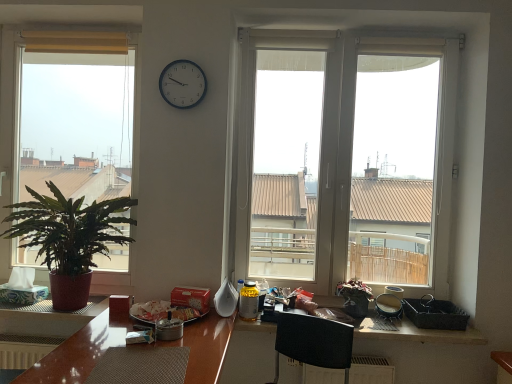
Question: Should I look upward or downward to see white plastic window at center, positioned as the 1th window in right-to-left order?

Choices:
 (A) up
 (B) down

Answer: (A)

Question: Is metallic clock at upper center inside white plastic window at center, the second window when ordered from left to right?

Choices:
 (A) yes
 (B) no

Answer: (B)

Question: Is white plastic window at center, positioned as the 1th window in right-to-left order, shorter than metallic clock at upper center?

Choices:
 (A) no
 (B) yes

Answer: (A)

Question: Is white plastic window at center, positioned as the 1th window in right-to-left order, aimed at metallic clock at upper center?

Choices:
 (A) yes
 (B) no

Answer: (B)

Question: From a real-world perspective, is white plastic window at center, positioned as the 1th window in right-to-left order, located beneath metallic clock at upper center?

Choices:
 (A) no
 (B) yes

Answer: (B)

Question: Can you confirm if white plastic window at center, positioned as the 1th window in right-to-left order, is thinner than metallic clock at upper center?

Choices:
 (A) yes
 (B) no

Answer: (B)

Question: Is white plastic window at center, the second window when ordered from left to right, smaller than metallic clock at upper center?

Choices:
 (A) yes
 (B) no

Answer: (B)

Question: Could you tell me if metallic clock at upper center is turned towards green matte plant at left, which appears as the 1th window when viewed from the left?

Choices:
 (A) yes
 (B) no

Answer: (B)

Question: Is metallic clock at upper center behind green matte plant at left, acting as the 2th window starting from the right?

Choices:
 (A) no
 (B) yes

Answer: (A)

Question: From a real-world perspective, is metallic clock at upper center located higher than green matte plant at left, which appears as the 1th window when viewed from the left?

Choices:
 (A) yes
 (B) no

Answer: (A)

Question: Would you say metallic clock at upper center is outside green matte plant at left, which appears as the 1th window when viewed from the left?

Choices:
 (A) no
 (B) yes

Answer: (B)

Question: Considering the relative sizes of metallic clock at upper center and green matte plant at left, which appears as the 1th window when viewed from the left, in the image provided, is metallic clock at upper center smaller than green matte plant at left, which appears as the 1th window when viewed from the left,?

Choices:
 (A) no
 (B) yes

Answer: (B)

Question: From the image's perspective, is metallic clock at upper center under green matte plant at left, acting as the 2th window starting from the right?

Choices:
 (A) no
 (B) yes

Answer: (A)

Question: Is white plastic window at center, the second window when ordered from left to right, aimed at black plastic picnic basket at lower right?

Choices:
 (A) no
 (B) yes

Answer: (A)